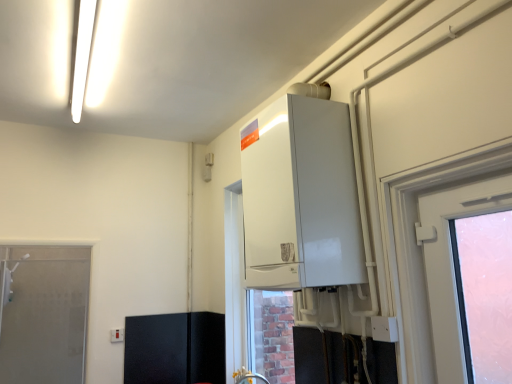
Question: Does matte silver faucet at lower center have a greater width compared to white glossy boiler at upper center?

Choices:
 (A) no
 (B) yes

Answer: (A)

Question: Is matte silver faucet at lower center beside white glossy boiler at upper center?

Choices:
 (A) no
 (B) yes

Answer: (A)

Question: Is matte silver faucet at lower center aimed at white glossy boiler at upper center?

Choices:
 (A) yes
 (B) no

Answer: (B)

Question: From the image's perspective, is matte silver faucet at lower center below white glossy boiler at upper center?

Choices:
 (A) no
 (B) yes

Answer: (B)

Question: Can you confirm if matte silver faucet at lower center is smaller than white glossy boiler at upper center?

Choices:
 (A) yes
 (B) no

Answer: (A)

Question: Is white glossy boiler at upper center completely or partially inside matte silver faucet at lower center?

Choices:
 (A) no
 (B) yes

Answer: (A)

Question: Would you say white glossy boiler at upper center is outside frosted glass door at left?

Choices:
 (A) yes
 (B) no

Answer: (A)

Question: Are white glossy boiler at upper center and frosted glass door at left far apart?

Choices:
 (A) no
 (B) yes

Answer: (B)

Question: Considering the relative sizes of white glossy boiler at upper center and frosted glass door at left in the image provided, is white glossy boiler at upper center shorter than frosted glass door at left?

Choices:
 (A) yes
 (B) no

Answer: (A)

Question: Is white glossy boiler at upper center positioned with its back to frosted glass door at left?

Choices:
 (A) no
 (B) yes

Answer: (A)

Question: Can you confirm if white glossy boiler at upper center is bigger than frosted glass door at left?

Choices:
 (A) yes
 (B) no

Answer: (A)

Question: Does white glossy boiler at upper center have a greater width compared to frosted glass door at left?

Choices:
 (A) yes
 (B) no

Answer: (A)

Question: Is black leather cabinet at lower left completely or partially outside of white glossy boiler at upper center?

Choices:
 (A) yes
 (B) no

Answer: (A)